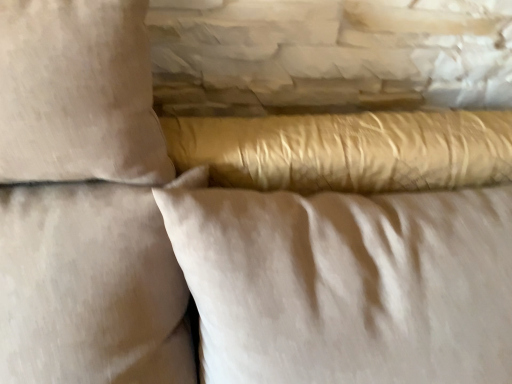
Locate an element on the screen. The height and width of the screenshot is (384, 512). beige fabric pillow at upper left, marked as the first pillow in a left-to-right arrangement is located at coordinates (90, 288).

Can we say satin gold pillow at center, the first pillow in the right-to-left sequence, lies outside beige cotton pillow at upper left, acting as the second pillow starting from the left?

Indeed, satin gold pillow at center, the first pillow in the right-to-left sequence, is completely outside beige cotton pillow at upper left, acting as the second pillow starting from the left.

Which is in front, satin gold pillow at center, which ranks as the 3th pillow in left-to-right order, or beige cotton pillow at upper left, acting as the second pillow starting from the left?

beige cotton pillow at upper left, acting as the second pillow starting from the left, is in front.

Which object is wider, satin gold pillow at center, which ranks as the 3th pillow in left-to-right order, or beige cotton pillow at upper left, marked as the second pillow in a right-to-left arrangement?

satin gold pillow at center, which ranks as the 3th pillow in left-to-right order, is wider.

From the image's perspective, which object appears higher, satin gold pillow at center, which ranks as the 3th pillow in left-to-right order, or beige cotton pillow at upper left, marked as the second pillow in a right-to-left arrangement?

From the image's view, beige cotton pillow at upper left, marked as the second pillow in a right-to-left arrangement, is above.

Is beige fabric pillow at upper left, marked as the first pillow in a left-to-right arrangement, directly adjacent to satin gold pillow at center, the first pillow in the right-to-left sequence?

beige fabric pillow at upper left, marked as the first pillow in a left-to-right arrangement, and satin gold pillow at center, the first pillow in the right-to-left sequence, are not in contact.

Is beige fabric pillow at upper left, marked as the first pillow in a left-to-right arrangement, taller or shorter than satin gold pillow at center, the first pillow in the right-to-left sequence?

beige fabric pillow at upper left, marked as the first pillow in a left-to-right arrangement, is taller than satin gold pillow at center, the first pillow in the right-to-left sequence.

Between beige fabric pillow at upper left, which is counted as the 3th pillow, starting from the right, and satin gold pillow at center, the first pillow in the right-to-left sequence, which one has larger width?

satin gold pillow at center, the first pillow in the right-to-left sequence.

Is beige cotton pillow at upper left, acting as the second pillow starting from the left, oriented away from satin gold pillow at center, the first pillow in the right-to-left sequence?

No, beige cotton pillow at upper left, acting as the second pillow starting from the left,'s orientation is not away from satin gold pillow at center, the first pillow in the right-to-left sequence.

Looking at this image, is beige cotton pillow at upper left, acting as the second pillow starting from the left, positioned in front of satin gold pillow at center, the first pillow in the right-to-left sequence?

Yes.

Can you confirm if beige cotton pillow at upper left, marked as the second pillow in a right-to-left arrangement, is smaller than satin gold pillow at center, the first pillow in the right-to-left sequence?

Indeed, beige cotton pillow at upper left, marked as the second pillow in a right-to-left arrangement, has a smaller size compared to satin gold pillow at center, the first pillow in the right-to-left sequence.

Is satin gold pillow at center, the first pillow in the right-to-left sequence, completely or partially outside of beige fabric pillow at upper left, which is counted as the 3th pillow, starting from the right?

Absolutely, satin gold pillow at center, the first pillow in the right-to-left sequence, is external to beige fabric pillow at upper left, which is counted as the 3th pillow, starting from the right.

From the image's perspective, is satin gold pillow at center, which ranks as the 3th pillow in left-to-right order, located above beige fabric pillow at upper left, marked as the first pillow in a left-to-right arrangement?

Incorrect, from the image's perspective, satin gold pillow at center, which ranks as the 3th pillow in left-to-right order, is lower than beige fabric pillow at upper left, marked as the first pillow in a left-to-right arrangement.

Between satin gold pillow at center, which ranks as the 3th pillow in left-to-right order, and beige fabric pillow at upper left, marked as the first pillow in a left-to-right arrangement, which one has less height?

With less height is satin gold pillow at center, which ranks as the 3th pillow in left-to-right order.

Looking at this image, is beige cotton pillow at upper left, marked as the second pillow in a right-to-left arrangement, inside the boundaries of beige fabric pillow at upper left, marked as the first pillow in a left-to-right arrangement, or outside?

beige cotton pillow at upper left, marked as the second pillow in a right-to-left arrangement, is not inside beige fabric pillow at upper left, marked as the first pillow in a left-to-right arrangement, it's outside.

Would you say beige cotton pillow at upper left, marked as the second pillow in a right-to-left arrangement, is a long distance from beige fabric pillow at upper left, which is counted as the 3th pillow, starting from the right?

No, beige cotton pillow at upper left, marked as the second pillow in a right-to-left arrangement, is in close proximity to beige fabric pillow at upper left, which is counted as the 3th pillow, starting from the right.

How many degrees apart are the facing directions of beige cotton pillow at upper left, marked as the second pillow in a right-to-left arrangement, and beige fabric pillow at upper left, marked as the first pillow in a left-to-right arrangement?

The facing directions of beige cotton pillow at upper left, marked as the second pillow in a right-to-left arrangement, and beige fabric pillow at upper left, marked as the first pillow in a left-to-right arrangement, are 0.0019 degrees apart.

Which is more to the left, beige cotton pillow at upper left, acting as the second pillow starting from the left, or beige fabric pillow at upper left, marked as the first pillow in a left-to-right arrangement?

beige fabric pillow at upper left, marked as the first pillow in a left-to-right arrangement, is more to the left.

Is beige fabric pillow at upper left, marked as the first pillow in a left-to-right arrangement, at the right side of beige cotton pillow at upper left, acting as the second pillow starting from the left?

No.

From a real-world perspective, is beige fabric pillow at upper left, which is counted as the 3th pillow, starting from the right, over beige cotton pillow at upper left, acting as the second pillow starting from the left?

No, from a real-world perspective, beige fabric pillow at upper left, which is counted as the 3th pillow, starting from the right, is not above beige cotton pillow at upper left, acting as the second pillow starting from the left.

Can you tell me how much beige fabric pillow at upper left, which is counted as the 3th pillow, starting from the right, and beige cotton pillow at upper left, acting as the second pillow starting from the left, differ in facing direction?

There is a 0.0019-degree angle between the facing directions of beige fabric pillow at upper left, which is counted as the 3th pillow, starting from the right, and beige cotton pillow at upper left, acting as the second pillow starting from the left.

Is beige fabric pillow at upper left, which is counted as the 3th pillow, starting from the right, in contact with beige cotton pillow at upper left, marked as the second pillow in a right-to-left arrangement?

There is a gap between beige fabric pillow at upper left, which is counted as the 3th pillow, starting from the right, and beige cotton pillow at upper left, marked as the second pillow in a right-to-left arrangement.

Where is `the 2nd pillow above the satin gold pillow at center, which ranks as the 3th pillow in left-to-right order (from the image's perspective)`? the 2nd pillow above the satin gold pillow at center, which ranks as the 3th pillow in left-to-right order (from the image's perspective) is located at coordinates (78, 94).

Starting from the beige fabric pillow at upper left, marked as the first pillow in a left-to-right arrangement, which pillow is the 2nd one to the right? Please provide its 2D coordinates.

[(346, 283)]

Looking at the image, which one is located further to satin gold pillow at center, the first pillow in the right-to-left sequence, beige cotton pillow at upper left, acting as the second pillow starting from the left, or beige fabric pillow at upper left, marked as the first pillow in a left-to-right arrangement?

beige cotton pillow at upper left, acting as the second pillow starting from the left, is positioned further to the anchor satin gold pillow at center, the first pillow in the right-to-left sequence.

Looking at the image, which one is located closer to beige fabric pillow at upper left, marked as the first pillow in a left-to-right arrangement, satin gold pillow at center, which ranks as the 3th pillow in left-to-right order, or beige cotton pillow at upper left, acting as the second pillow starting from the left?

beige cotton pillow at upper left, acting as the second pillow starting from the left, is positioned closer to the anchor beige fabric pillow at upper left, marked as the first pillow in a left-to-right arrangement.

Based on their spatial positions, is satin gold pillow at center, the first pillow in the right-to-left sequence, or beige fabric pillow at upper left, which is counted as the 3th pillow, starting from the right, further from beige cotton pillow at upper left, acting as the second pillow starting from the left?

Based on the image, satin gold pillow at center, the first pillow in the right-to-left sequence, appears to be further to beige cotton pillow at upper left, acting as the second pillow starting from the left.

Looking at the image, which one is located closer to beige fabric pillow at upper left, marked as the first pillow in a left-to-right arrangement, beige cotton pillow at upper left, marked as the second pillow in a right-to-left arrangement, or satin gold pillow at center, the first pillow in the right-to-left sequence?

beige cotton pillow at upper left, marked as the second pillow in a right-to-left arrangement, is positioned closer to the anchor beige fabric pillow at upper left, marked as the first pillow in a left-to-right arrangement.

Looking at this image, estimate the real-world distances between objects in this image. Which object is closer to beige cotton pillow at upper left, acting as the second pillow starting from the left, beige fabric pillow at upper left, which is counted as the 3th pillow, starting from the right, or satin gold pillow at center, which ranks as the 3th pillow in left-to-right order?

Based on the image, beige fabric pillow at upper left, which is counted as the 3th pillow, starting from the right, appears to be nearer to beige cotton pillow at upper left, acting as the second pillow starting from the left.

Looking at this image, which object lies nearer to the anchor point satin gold pillow at center, which ranks as the 3th pillow in left-to-right order, beige fabric pillow at upper left, marked as the first pillow in a left-to-right arrangement, or beige cotton pillow at upper left, marked as the second pillow in a right-to-left arrangement?

The object closer to satin gold pillow at center, which ranks as the 3th pillow in left-to-right order, is beige fabric pillow at upper left, marked as the first pillow in a left-to-right arrangement.

The width and height of the screenshot is (512, 384). Find the location of `pillow that lies between beige cotton pillow at upper left, marked as the second pillow in a right-to-left arrangement, and satin gold pillow at center, which ranks as the 3th pillow in left-to-right order, from top to bottom`. pillow that lies between beige cotton pillow at upper left, marked as the second pillow in a right-to-left arrangement, and satin gold pillow at center, which ranks as the 3th pillow in left-to-right order, from top to bottom is located at coordinates (90, 288).